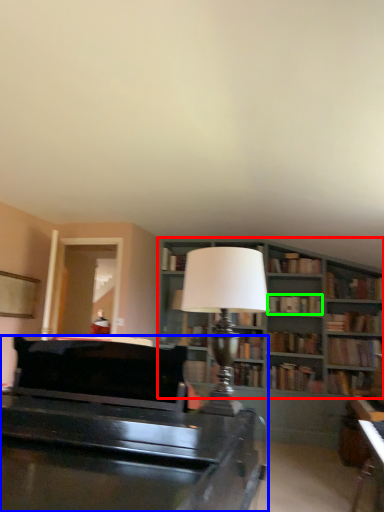
Question: Estimate the real-world distances between objects in this image. Which object is closer to bookcase (highlighted by a red box), piano (highlighted by a blue box) or book (highlighted by a green box)?

Choices:
 (A) piano
 (B) book

Answer: (B)